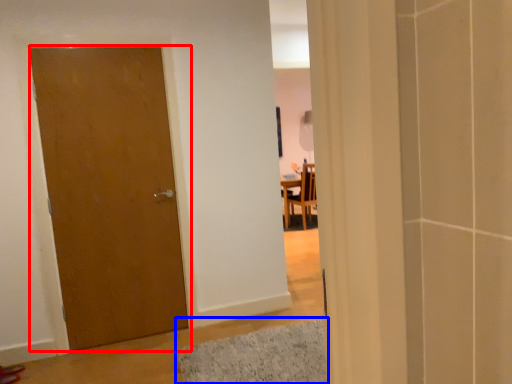
Question: Which object appears closest to the camera in this image, door (highlighted by a red box) or bath mat (highlighted by a blue box)?

Choices:
 (A) door
 (B) bath mat

Answer: (B)